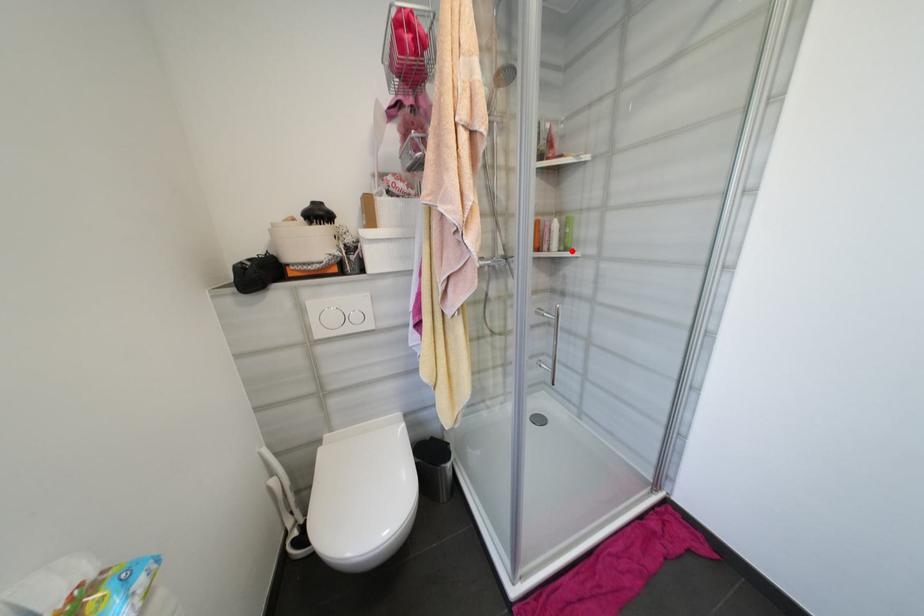
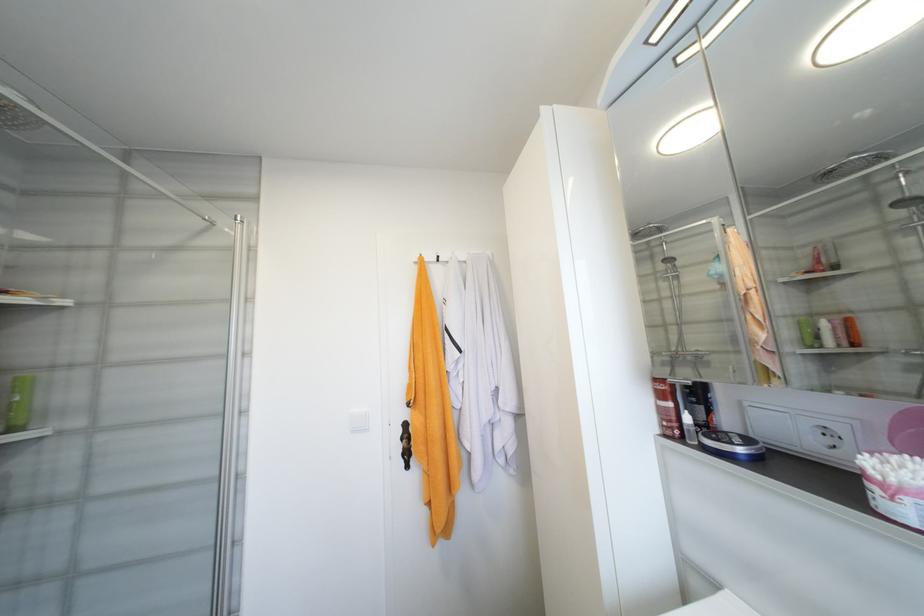
The point at the highlighted location is marked in the first image. Where is the corresponding point in the second image?

(19, 430)